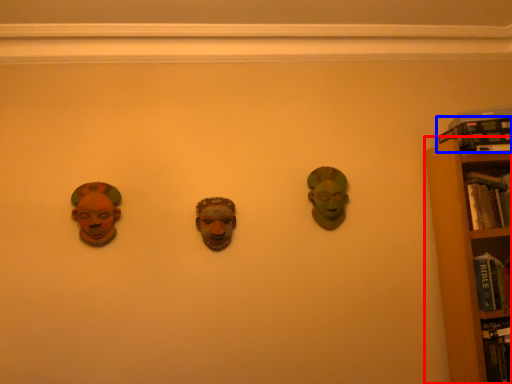
Question: Which object appears farthest to the camera in this image, bookcase (highlighted by a red box) or book (highlighted by a blue box)?

Choices:
 (A) bookcase
 (B) book

Answer: (B)